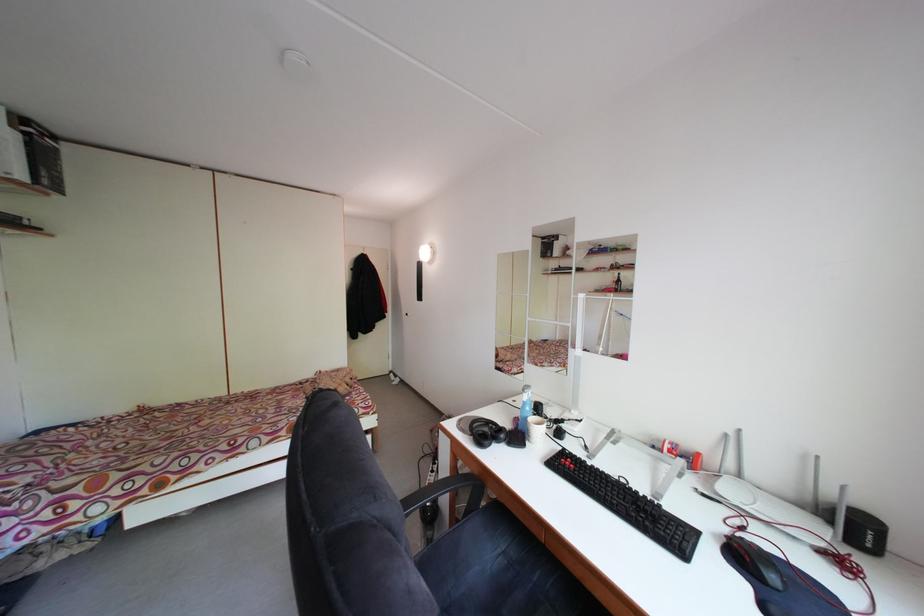
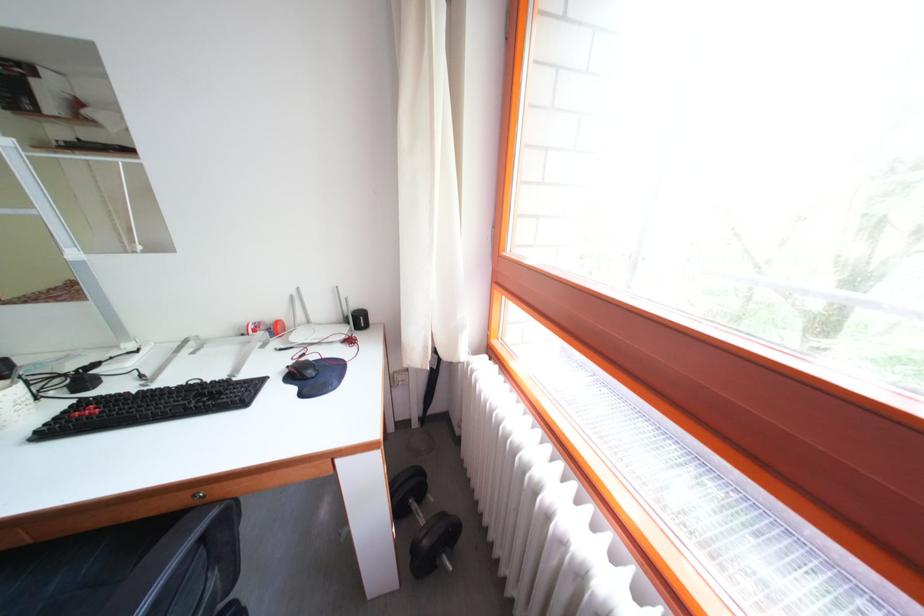
Where in the second image is the point corresponding to [630,487] from the first image?

(201, 389)